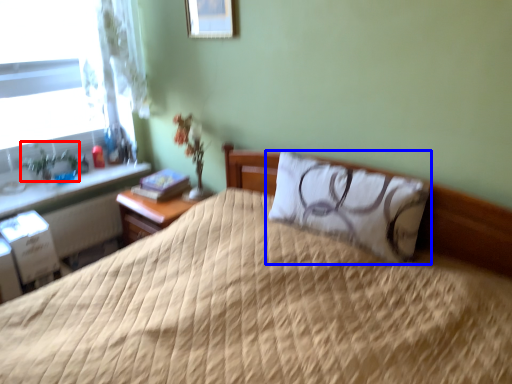
Question: Among these objects, which one is farthest to the camera, plant (highlighted by a red box) or pillow (highlighted by a blue box)?

Choices:
 (A) plant
 (B) pillow

Answer: (A)